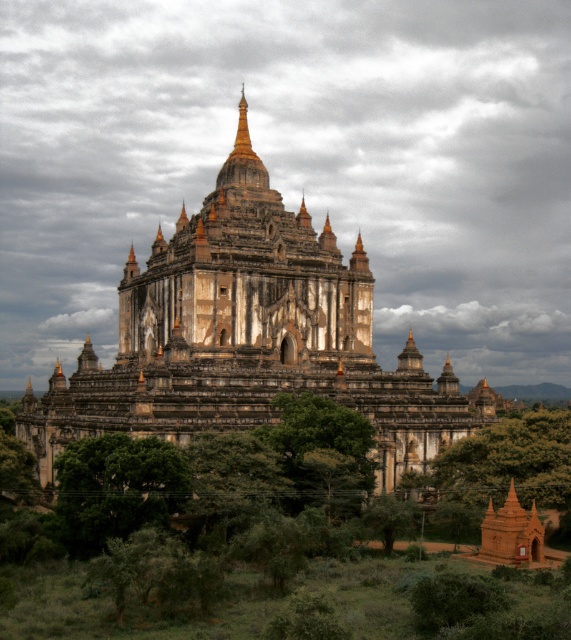
Question: Is green leafy tree at lower left bigger than green leafy tree at center?

Choices:
 (A) yes
 (B) no

Answer: (B)

Question: Among these objects, which one is farthest from the camera?

Choices:
 (A) golden stone temple at center
 (B) green leafy tree at center

Answer: (A)

Question: Can you confirm if golden stone temple at center is positioned below green leafy tree at lower left?

Choices:
 (A) no
 (B) yes

Answer: (A)

Question: From the image, what is the correct spatial relationship of golden stone temple at center in relation to green leafy tree at lower center?

Choices:
 (A) left
 (B) right

Answer: (A)

Question: Which of the following is the farthest from the observer?

Choices:
 (A) (339, 426)
 (B) (78, 541)
 (C) (270, 260)

Answer: (C)

Question: Which object appears closest to the camera in this image?

Choices:
 (A) green leafy tree at lower left
 (B) green leafy tree at lower center
 (C) golden stone temple at center
 (D) green leafy tree at center

Answer: (A)